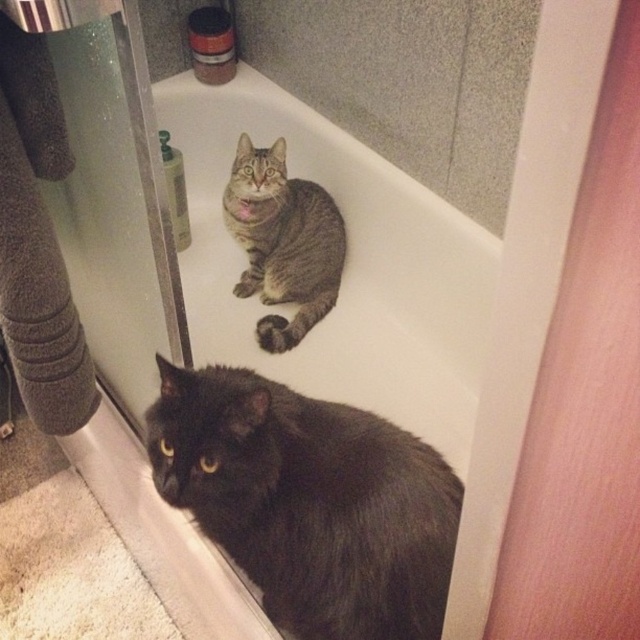
You are a cat owner who wants to ensure both cats have enough space in the bathroom. Given the white glossy bathtub at upper center and the tabby fur cat at center, which object occupies more area in the image?

The white glossy bathtub at upper center is bigger than the tabby fur cat at center, so it occupies more area in the image.

You are a small toy measuring 2 inches in length. You want to roll from the white glossy bathtub at upper center to the tabby fur cat at center. Can you reach the cat without any obstacles?

The distance between the white glossy bathtub at upper center and the tabby fur cat at center is 5.65 inches, which is greater than the toy length of 2 inches. Therefore, the toy can roll the distance and reach the cat.

You are standing in the bathroom and see two points marked on the floor. The first point is at coordinate point (221, 356) and the second is at point (426, 572). If you want to walk from the first point to the second point, which direction should you move relative to the bathroom layout?

Point (221, 356) is behind point (426, 572), so to move from the first point to the second point, you should move forward towards the direction of the second point.